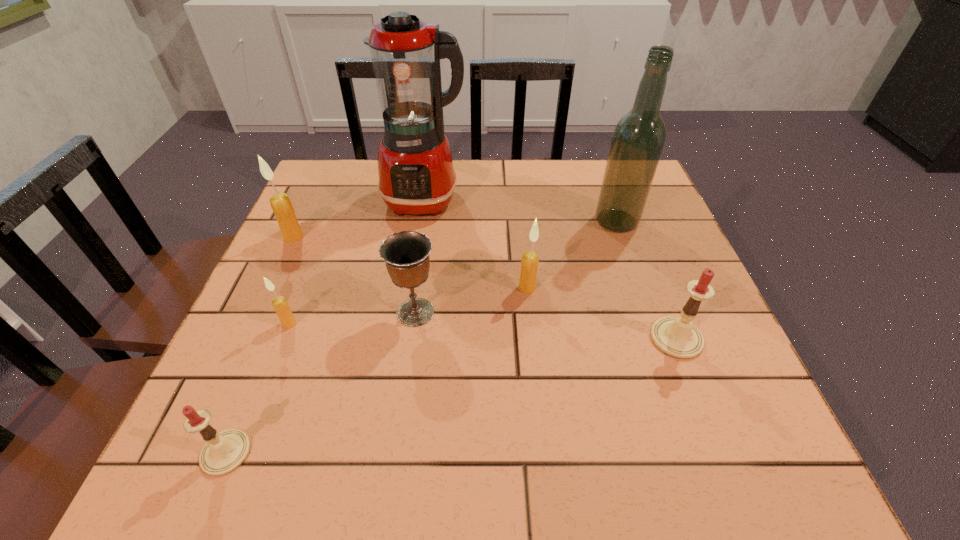
Locate an element on the screen. food processor is located at coordinates (416, 176).

The width and height of the screenshot is (960, 540). I want to click on green liquor, so click(638, 139).

I want to click on the farthest candle, so click(281, 205).

The width and height of the screenshot is (960, 540). Find the location of `the sixth shortest object`. the sixth shortest object is located at coordinates (281, 205).

Where is `the second nearest cream candle`? This screenshot has height=540, width=960. the second nearest cream candle is located at coordinates (529, 263).

Locate an element on the screen. the rightmost cream candle is located at coordinates (529, 263).

The height and width of the screenshot is (540, 960). I want to click on the rightmost candle, so click(x=677, y=337).

At what (x,y) coordinates should I click in order to perform the action: click on the bigger red candle. Please return your answer as a coordinate pair (x, y). Image resolution: width=960 pixels, height=540 pixels. Looking at the image, I should click on (677, 337).

Locate an element on the screen. The width and height of the screenshot is (960, 540). chalice is located at coordinates (406, 254).

What are the coordinates of `the nearest cream candle` in the screenshot? It's located at (281, 306).